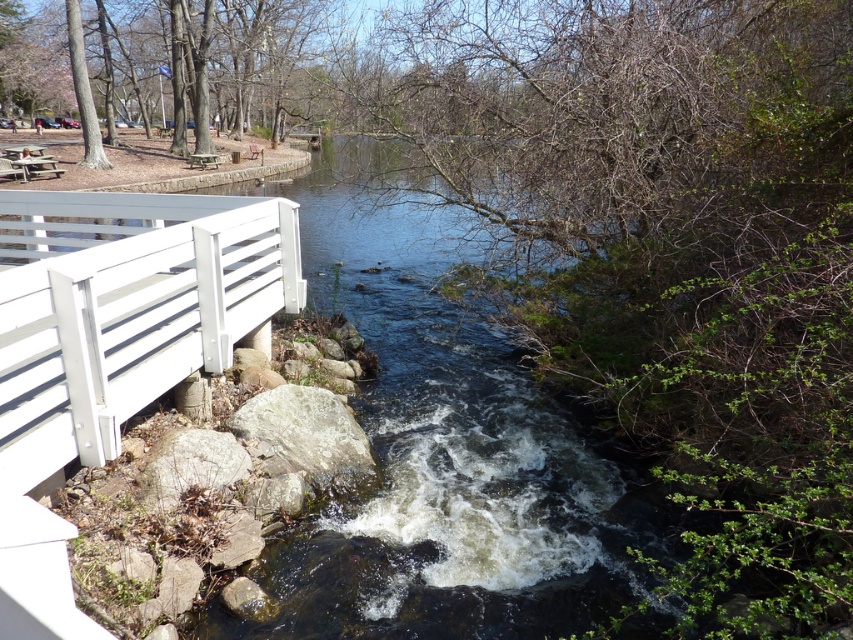
Which of these two, white matte bridge at left or gray rough rock at lower center, stands taller?

gray rough rock at lower center

Can you confirm if white matte bridge at left is positioned above gray rough rock at lower center?

Yes.

Between point (38, 540) and point (352, 419), which one is positioned in front?

Positioned in front is point (38, 540).

The height and width of the screenshot is (640, 853). In order to click on white matte bridge at left in this screenshot , I will do `click(112, 346)`.

Does gray rough rock at lower left appear on the left side of wooden picnic table at left?

Incorrect, gray rough rock at lower left is not on the left side of wooden picnic table at left.

The image size is (853, 640). In order to click on gray rough rock at lower left in this screenshot , I will do `click(189, 465)`.

Where is `gray rough rock at lower left`? This screenshot has height=640, width=853. gray rough rock at lower left is located at coordinates click(189, 465).

Is gray rough rock at lower center to the right of gray rough rock at lower left from the viewer's perspective?

Yes, gray rough rock at lower center is to the right of gray rough rock at lower left.

Is gray rough rock at lower center shorter than gray rough rock at lower left?

In fact, gray rough rock at lower center may be taller than gray rough rock at lower left.

Is point (262, 426) less distant than point (184, 451)?

No, it is behind (184, 451).

The width and height of the screenshot is (853, 640). What are the coordinates of `gray rough rock at lower center` in the screenshot? It's located at (305, 428).